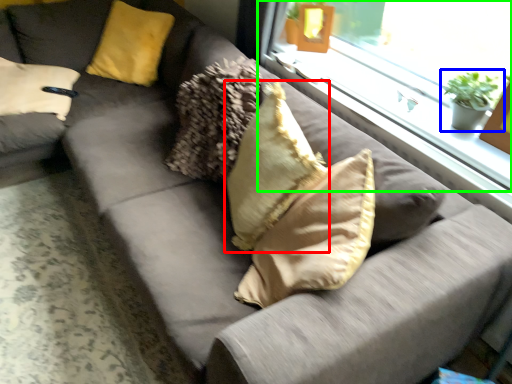
Question: Which object is the farthest from pillow (highlighted by a red box)? Choose among these: houseplant (highlighted by a blue box) or window (highlighted by a green box).

Choices:
 (A) houseplant
 (B) window

Answer: (A)